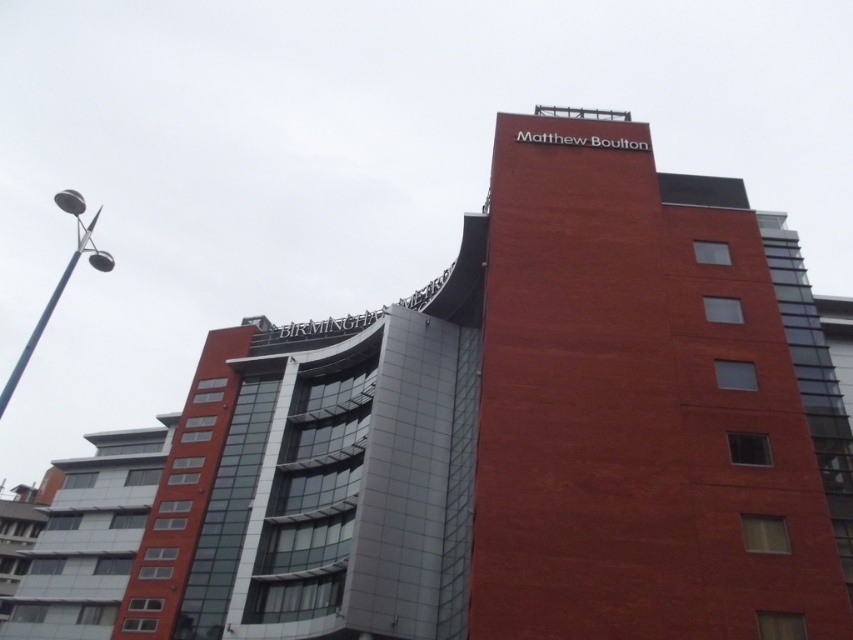
Question: Is red brick building at center wider than black metal pole at upper left?

Choices:
 (A) yes
 (B) no

Answer: (B)

Question: From the image, what is the correct spatial relationship of red brick building at center in relation to black metal pole at upper left?

Choices:
 (A) right
 (B) left

Answer: (A)

Question: Which point appears farthest from the camera in this image?

Choices:
 (A) (538, 161)
 (B) (99, 212)

Answer: (B)

Question: Where is red brick building at center located in relation to black metal pole at upper left in the image?

Choices:
 (A) above
 (B) below

Answer: (B)

Question: Which object appears closest to the camera in this image?

Choices:
 (A) black metal pole at upper left
 (B) red brick building at center

Answer: (B)